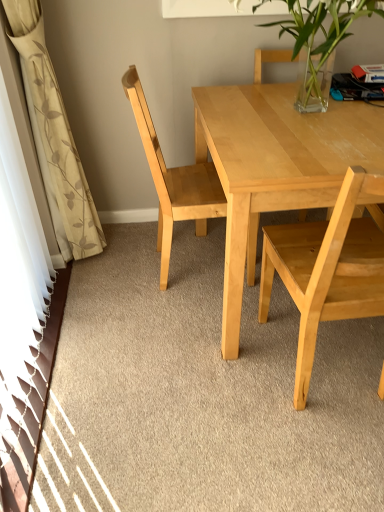
Locate an element on the screen. This screenshot has height=512, width=384. vacant region under clear glass vase at upper center (from a real-world perspective) is located at coordinates (328, 116).